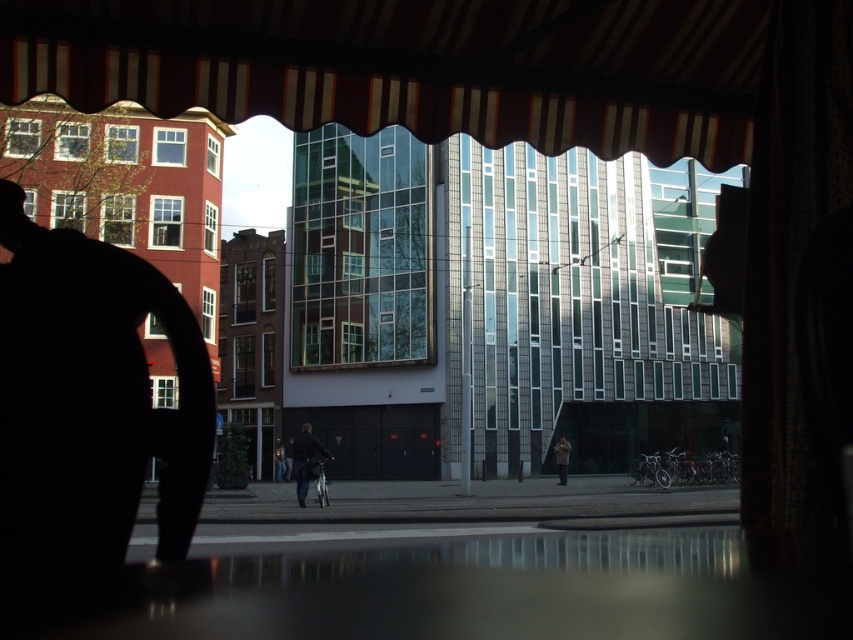
Is striped fabric awning at upper center above light brown leather jacket at center?

Yes.

Is point (374, 42) closer to viewer compared to point (561, 483)?

That is True.

Locate an element on the screen. This screenshot has width=853, height=640. striped fabric awning at upper center is located at coordinates (413, 67).

This screenshot has width=853, height=640. Describe the element at coordinates (305, 460) in the screenshot. I see `dark blue jeans at center` at that location.

The height and width of the screenshot is (640, 853). Find the location of `dark blue jeans at center`. dark blue jeans at center is located at coordinates (305, 460).

Based on the photo, does striped fabric awning at upper center have a smaller size compared to dark blue jeans at center?

Yes, striped fabric awning at upper center is smaller than dark blue jeans at center.

Who is positioned more to the right, striped fabric awning at upper center or dark blue jeans at center?

striped fabric awning at upper center

Which is behind, point (743, 129) or point (293, 458)?

Point (293, 458)

Locate an element on the screen. This screenshot has width=853, height=640. striped fabric awning at upper center is located at coordinates (413, 67).